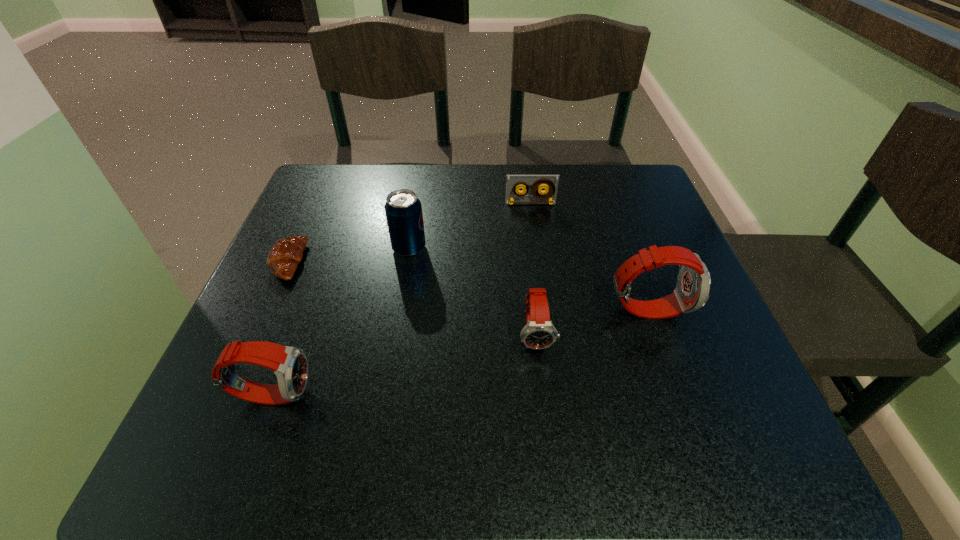
Image resolution: width=960 pixels, height=540 pixels. I want to click on free space located 0.150m on the face of the second tallest watch, so click(403, 394).

Identify the location of blank space located on the face of the second watch from left to right. The image size is (960, 540). (541, 387).

Locate an element on the screen. The height and width of the screenshot is (540, 960). free spot located 0.150m at the front of the videotape with visible reels is located at coordinates (537, 245).

Identify the location of vacant area located 0.290m on the back of the crescent roll. (329, 172).

Where is `vacant space located on the right of the soda can`? The width and height of the screenshot is (960, 540). vacant space located on the right of the soda can is located at coordinates (526, 248).

Identify the location of object at the far edge. This screenshot has height=540, width=960. (513, 182).

The height and width of the screenshot is (540, 960). I want to click on object present at the near edge, so click(290, 365).

Locate an element on the screen. watch that is at the left edge is located at coordinates (290, 365).

Image resolution: width=960 pixels, height=540 pixels. Identify the location of crescent roll that is positioned at the left edge. (285, 255).

Identify the location of object that is at the right edge. The width and height of the screenshot is (960, 540). (692, 291).